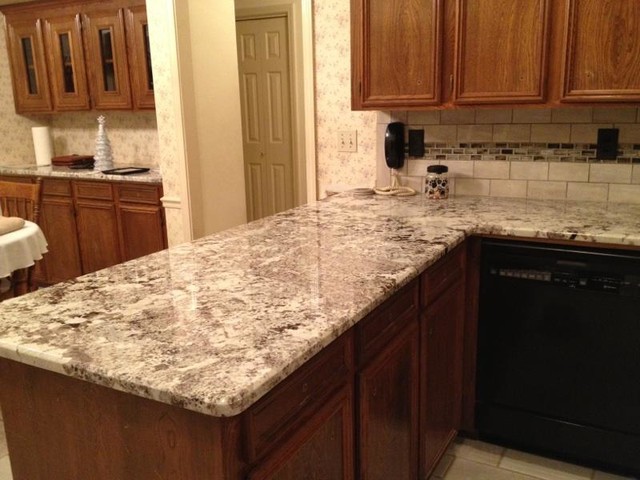
The width and height of the screenshot is (640, 480). In order to click on sit around table in this screenshot , I will do `click(29, 209)`.